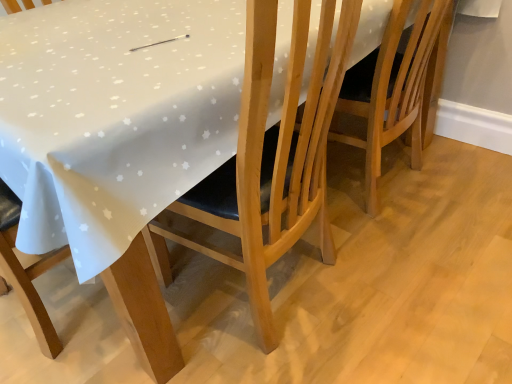
Question: In terms of height, does light brown wooden chair at center, acting as the second chair starting from the left, look taller or shorter compared to wooden chair at center, acting as the 1th chair starting from the left?

Choices:
 (A) tall
 (B) short

Answer: (B)

Question: Considering the positions of point (423, 132) and point (266, 342), is point (423, 132) closer or farther from the camera than point (266, 342)?

Choices:
 (A) closer
 (B) farther

Answer: (B)

Question: Is light brown wooden chair at center, acting as the second chair starting from the left, in front of or behind wooden chair at center, acting as the 1th chair starting from the left, in the image?

Choices:
 (A) behind
 (B) front

Answer: (A)

Question: Considering their positions, is wooden chair at center, acting as the 1th chair starting from the left, located in front of or behind light brown wooden chair at center, acting as the second chair starting from the left?

Choices:
 (A) front
 (B) behind

Answer: (A)

Question: In terms of width, does wooden chair at center, acting as the 1th chair starting from the left, look wider or thinner when compared to light brown wooden chair at center, acting as the second chair starting from the left?

Choices:
 (A) thin
 (B) wide

Answer: (A)

Question: From a real-world perspective, is wooden chair at center, acting as the 1th chair starting from the left, positioned above or below light brown wooden chair at center, which ranks as the first chair in right-to-left order?

Choices:
 (A) above
 (B) below

Answer: (A)

Question: In terms of height, does wooden chair at center, which ranks as the 2th chair in right-to-left order, look taller or shorter compared to light brown wooden chair at center, acting as the second chair starting from the left?

Choices:
 (A) short
 (B) tall

Answer: (B)